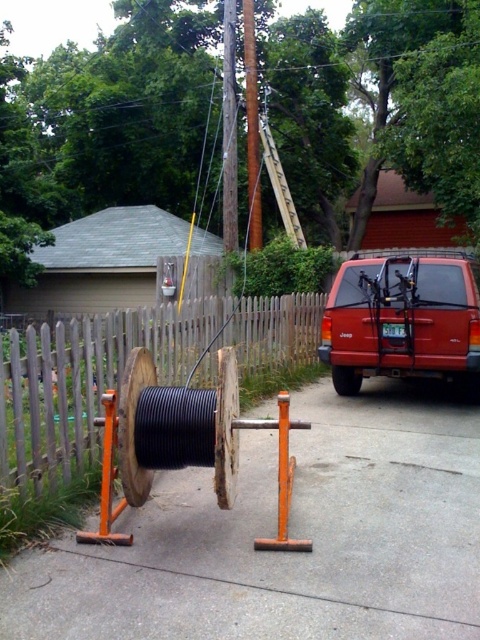
You are a delivery person trying to unload a package from your matte red suv at center right. The black rubber cable at center is blocking the path. Can you drive forward a little to bypass the cable?

The black rubber cable at center is not as tall as the matte red suv at center right, so driving forward should allow the vehicle to pass over the cable without any issues.

You are standing in the residential outdoor scene. You see a black rubber cable at center and a wooden picket fence at center. Which object is positioned to the right side of the other?

The black rubber cable at center is to the right of wooden picket fence at center.

You are standing at the center of the image and want to reach the black rubber cable at center. Which direction should you move to get closer to it?

The black rubber cable at center is already at the center of the image, so you donot need to move in any direction to get closer to it.